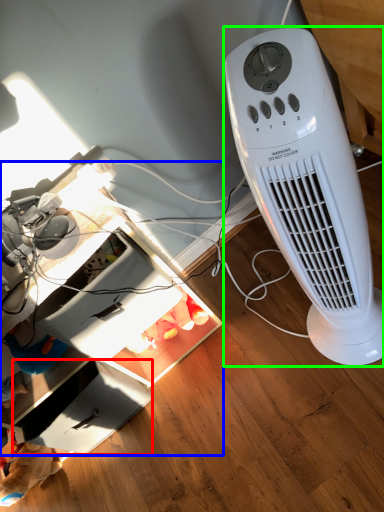
Question: Based on their relative distances, which object is farther from drawer (highlighted by a red box)? Choose from computer desk (highlighted by a blue box) and home appliance (highlighted by a green box).

Choices:
 (A) computer desk
 (B) home appliance

Answer: (B)